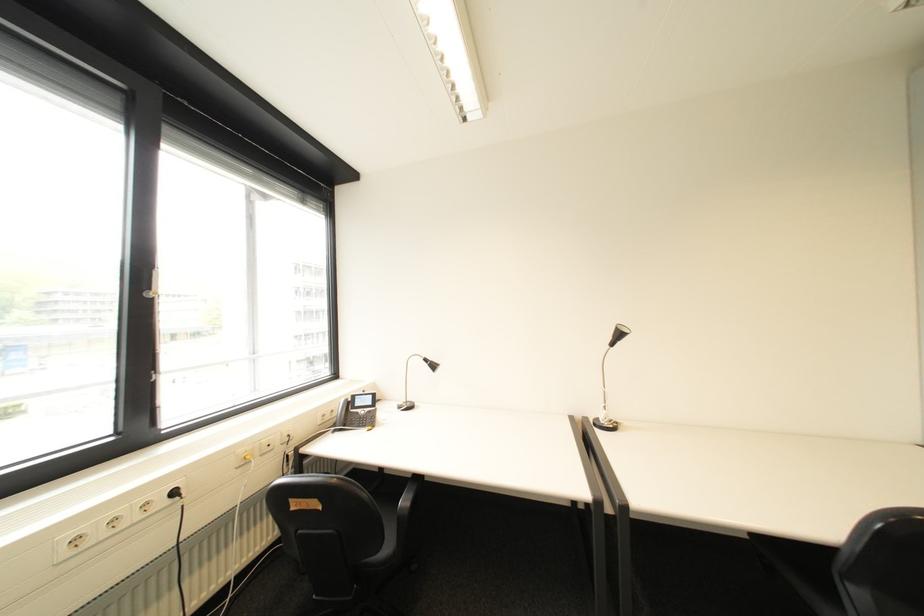
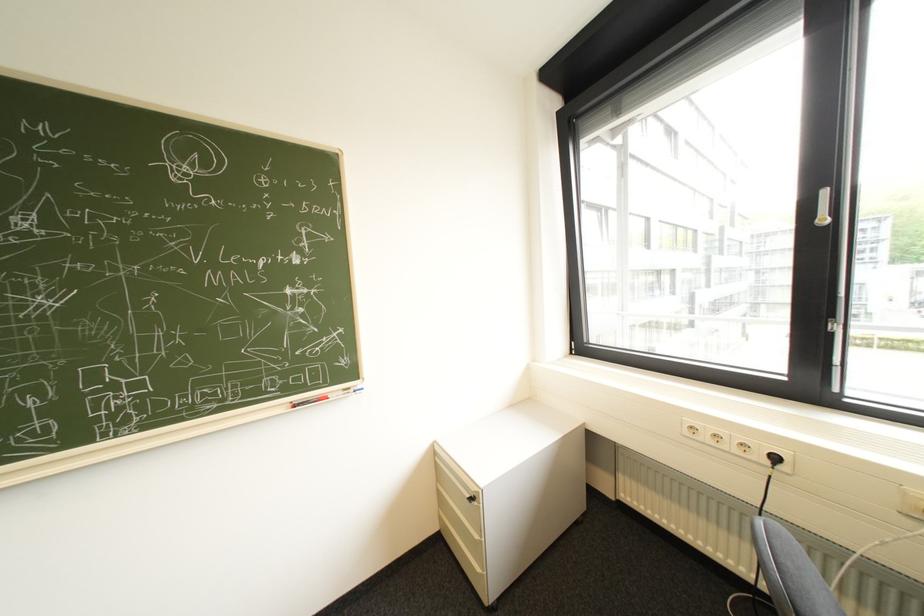
Locate, in the second image, the point that corresponds to pixel 108 536 in the first image.

(715, 438)